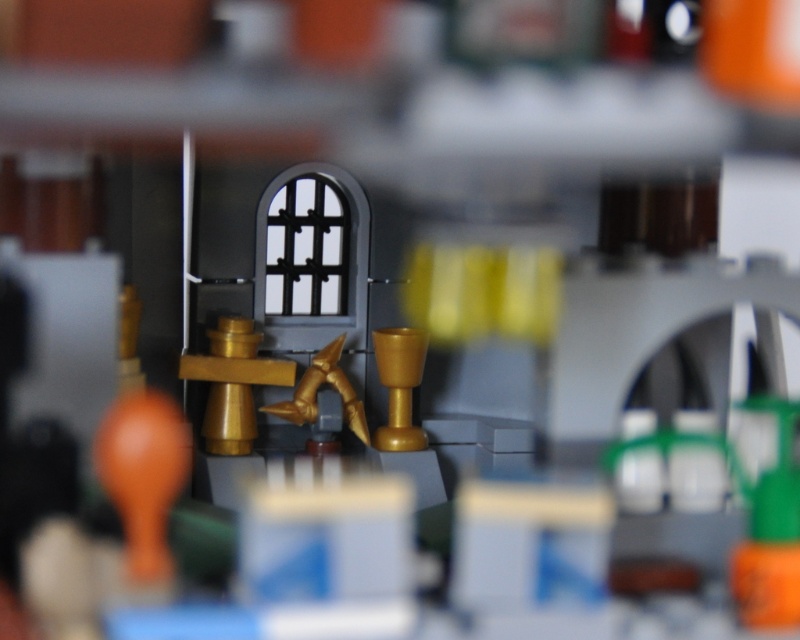
Is gold metallic pipe at center further to camera compared to gold metallic goblet at center?

No, it is in front of gold metallic goblet at center.

In order to click on gold metallic pipe at center in this screenshot , I will do [x=232, y=384].

Does matte orange balloon at lower left have a smaller size compared to gold metallic pipe at center?

Yes.

Can you confirm if matte orange balloon at lower left is positioned below gold metallic pipe at center?

No.

Between point (118, 413) and point (216, 396), which one is positioned in front?

Point (118, 413) is more forward.

At what (x,y) coordinates should I click in order to perform the action: click on matte orange balloon at lower left. Please return your answer as a coordinate pair (x, y). Looking at the image, I should click on (144, 474).

Can you confirm if matte orange balloon at lower left is positioned below gold metallic chalice at center?

Actually, matte orange balloon at lower left is above gold metallic chalice at center.

Does matte orange balloon at lower left have a lesser width compared to gold metallic chalice at center?

Yes, matte orange balloon at lower left is thinner than gold metallic chalice at center.

Image resolution: width=800 pixels, height=640 pixels. Describe the element at coordinates (144, 474) in the screenshot. I see `matte orange balloon at lower left` at that location.

Where is `matte orange balloon at lower left`? This screenshot has width=800, height=640. matte orange balloon at lower left is located at coordinates (144, 474).